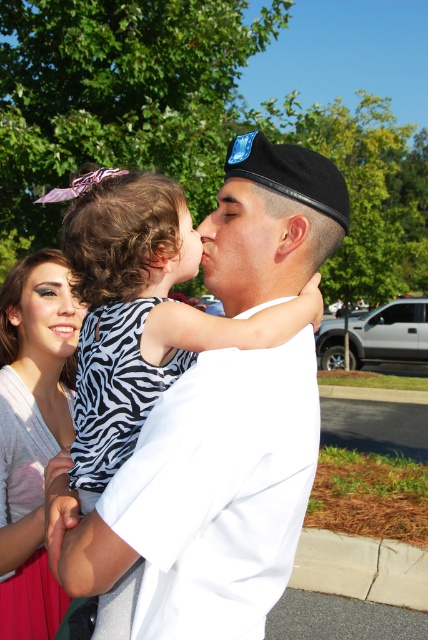
Question: Considering the real-world distances, which object is farthest from the white cotton shirt at center?

Choices:
 (A) matte white sweater at center
 (B) matte black eye at upper left
 (C) zebra print face at center

Answer: (B)

Question: Can you confirm if smooth skin face at center is positioned below matte black eye at upper left?

Choices:
 (A) yes
 (B) no

Answer: (B)

Question: Is zebra print face at center closer to camera compared to matte black nose at center?

Choices:
 (A) no
 (B) yes

Answer: (A)

Question: Which point is farther from the camera taking this photo?

Choices:
 (A) (246, 296)
 (B) (208, 230)
 (C) (42, 323)
 (D) (85, 337)

Answer: (C)

Question: Can you confirm if matte white sweater at center is wider than white uniform at center?

Choices:
 (A) yes
 (B) no

Answer: (A)

Question: Which point is closer to the camera?

Choices:
 (A) matte black eye at upper left
 (B) zebra print face at center

Answer: (B)